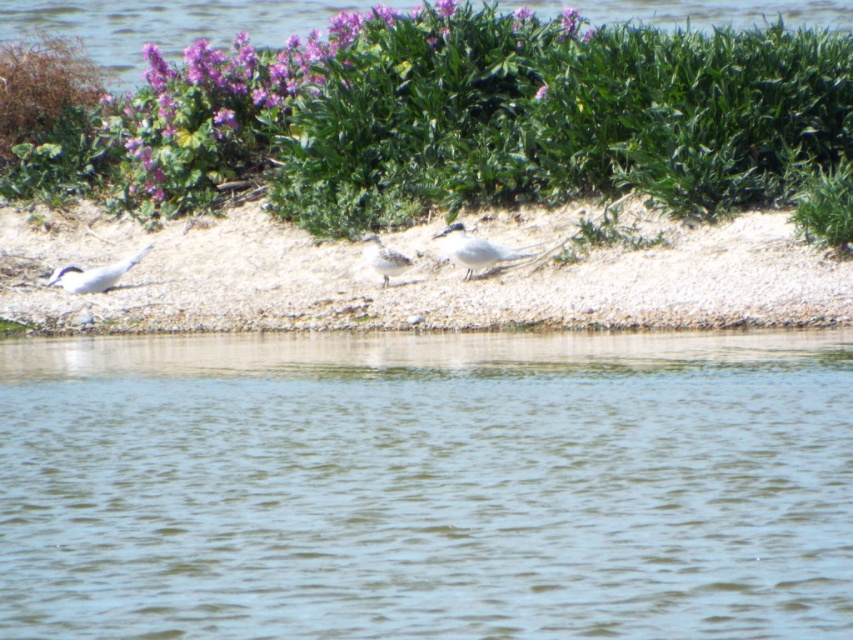
Question: Among these objects, which one is farthest from the camera?

Choices:
 (A) clear water at lower center
 (B) white glossy bird at center
 (C) white speckled feather at center
 (D) green leafy shrubs at upper center

Answer: (B)

Question: Considering the relative positions of white matte bird at left and white speckled feather at center in the image provided, where is white matte bird at left located with respect to white speckled feather at center?

Choices:
 (A) above
 (B) below

Answer: (B)

Question: Which point is farther to the camera?

Choices:
 (A) (421, 392)
 (B) (135, 310)
 (C) (387, 273)

Answer: (B)

Question: Does white gravelly sand at center have a larger size compared to clear water at upper center?

Choices:
 (A) yes
 (B) no

Answer: (B)

Question: Which of the following is the farthest from the observer?

Choices:
 (A) white glossy bird at center
 (B) white gravelly sand at center

Answer: (A)

Question: Is clear water at lower center to the right of white matte bird at left from the viewer's perspective?

Choices:
 (A) no
 (B) yes

Answer: (B)